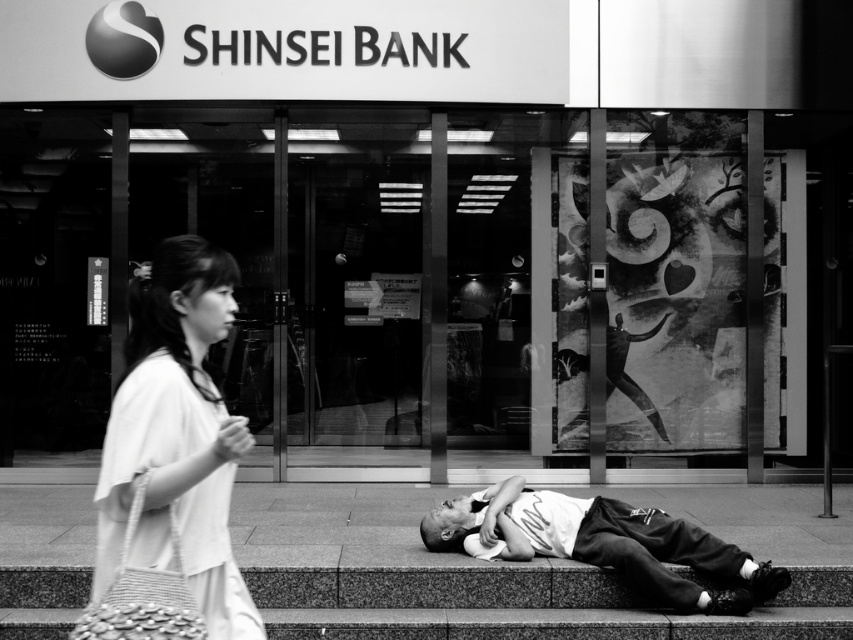
Question: Which of the following is the closest to the observer?

Choices:
 (A) white fabric bag at left
 (B) granite pavement at lower center

Answer: (A)

Question: Does granite pavement at lower center have a larger size compared to white fabric bag at left?

Choices:
 (A) yes
 (B) no

Answer: (A)

Question: Can you confirm if granite pavement at lower center is wider than white fabric bag at left?

Choices:
 (A) yes
 (B) no

Answer: (A)

Question: Which point is farther to the camera?

Choices:
 (A) granite pavement at lower center
 (B) white cotton shirt at lower center
 (C) white fabric bag at left

Answer: (B)

Question: Is granite pavement at lower center to the right of white fabric bag at left from the viewer's perspective?

Choices:
 (A) yes
 (B) no

Answer: (A)

Question: Based on their relative distances, which object is nearer to the white fabric bag at left?

Choices:
 (A) granite pavement at lower center
 (B) white cotton shirt at lower center

Answer: (A)